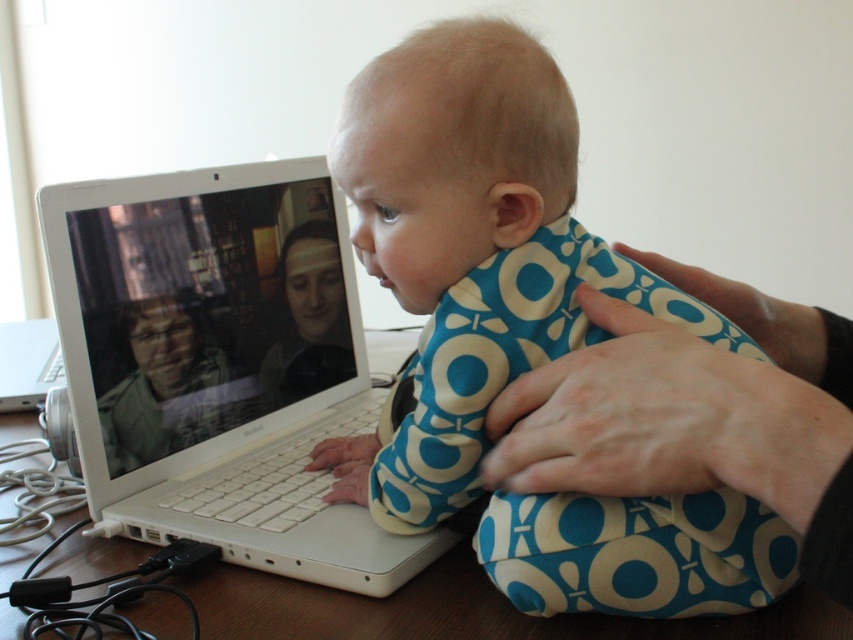
Between point (410, 294) and point (792, 438), which one is positioned behind?

The point (410, 294) is more distant.

Does blue printed onesie at center appear over blue printed fabric at center?

Yes.

Where is `blue printed onesie at center`? Image resolution: width=853 pixels, height=640 pixels. blue printed onesie at center is located at coordinates (473, 252).

Image resolution: width=853 pixels, height=640 pixels. I want to click on blue printed onesie at center, so click(473, 252).

Is green matte jacket at center thinner than matte plastic face at center?

No, green matte jacket at center is not thinner than matte plastic face at center.

Image resolution: width=853 pixels, height=640 pixels. What do you see at coordinates (167, 387) in the screenshot? I see `green matte jacket at center` at bounding box center [167, 387].

Find the location of a particular element. This screenshot has width=853, height=640. green matte jacket at center is located at coordinates (167, 387).

Is white plastic laptop at center bigger than matte plastic face at center?

Yes.

Which is below, white plastic laptop at center or matte plastic face at center?

Positioned lower is white plastic laptop at center.

Measure the distance between white plastic laptop at center and camera.

The distance of white plastic laptop at center from camera is 55.22 centimeters.

You are a GUI agent. You are given a task and a screenshot of the screen. Output one action in this format:
    pyautogui.click(x=<x>, y=<y>)
    Task: Click on the white plastic laptop at center
    This screenshot has width=853, height=640.
    Given the screenshot: What is the action you would take?
    pyautogui.click(x=219, y=365)